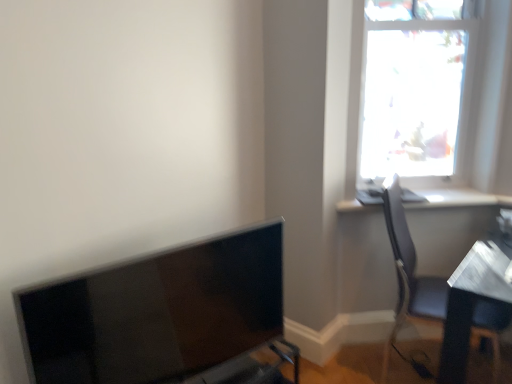
Question: Is white glossy window sill at upper right taller or shorter than matte gray chair at right?

Choices:
 (A) short
 (B) tall

Answer: (A)

Question: Which is correct: white glossy window sill at upper right is inside matte gray chair at right, or outside of it?

Choices:
 (A) outside
 (B) inside

Answer: (A)

Question: Which object is positioned closest to the matte black monitor at lower left?

Choices:
 (A) transparent glass window at upper right
 (B) matte gray chair at right
 (C) white glossy window sill at upper right

Answer: (B)

Question: Estimate the real-world distances between objects in this image. Which object is closer to the matte gray chair at right?

Choices:
 (A) transparent glass window at upper right
 (B) matte black monitor at lower left
 (C) white glossy window sill at upper right

Answer: (C)